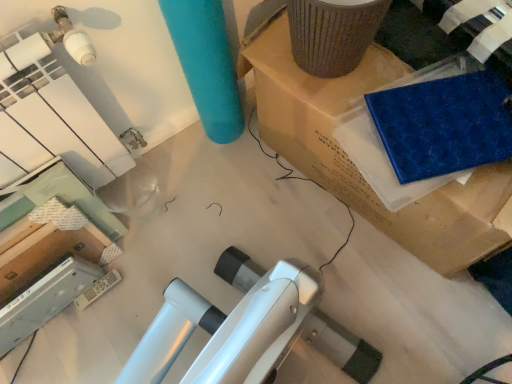
Locate an element on the screen. Image resolution: width=512 pixels, height=384 pixels. empty space that is ontop of blue sponge at upper right (from a real-world perspective) is located at coordinates (440, 124).